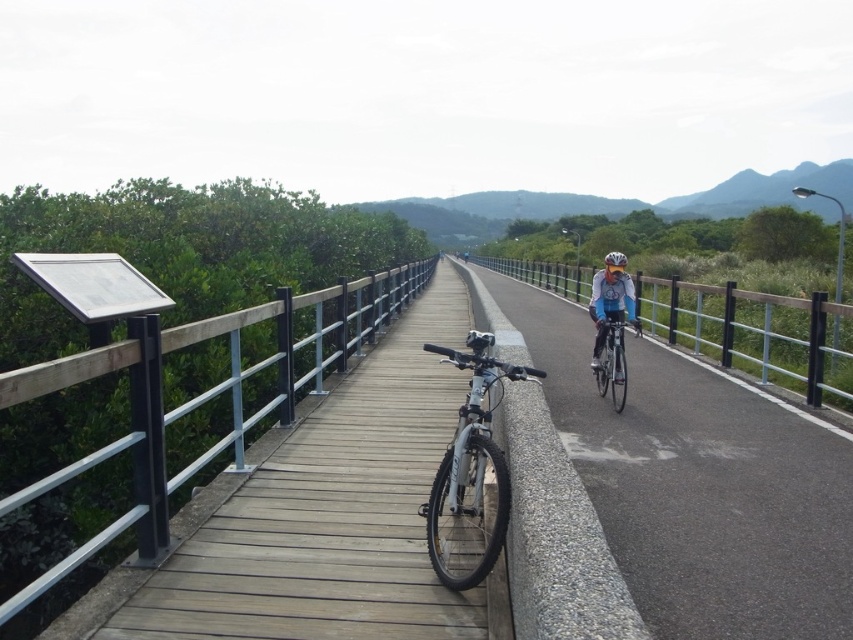
In the scene shown: You are standing on the wooden boardwalk at center and want to move to the wooden rail at left. Is there enough space between them for you to walk sideways without touching either?

The wooden boardwalk at center might be wider than wooden rail at left, but since the exact width isn t specified, it s uncertain if there s enough space to walk sideways without touching either.